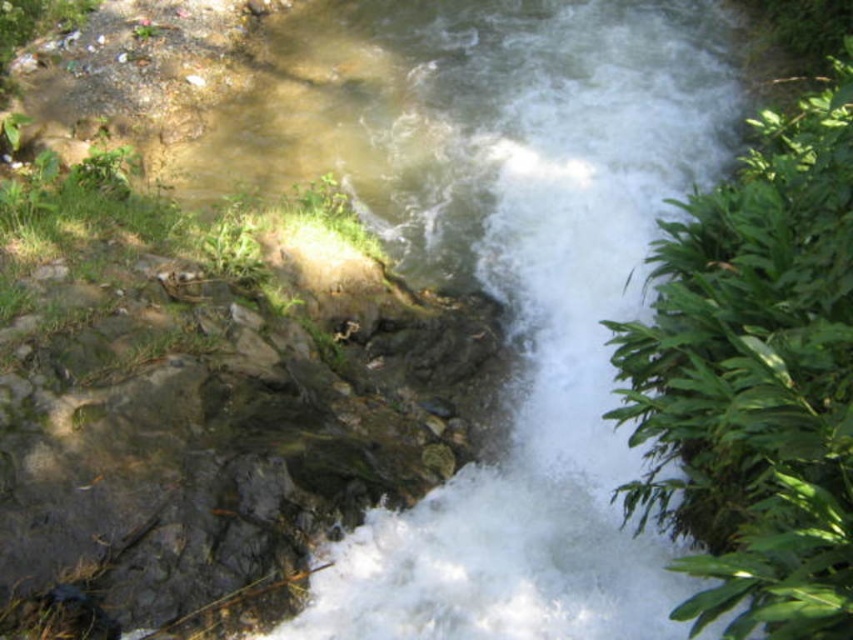
Between clear water at center and green leafy plant at right, which one has more height?

With more height is clear water at center.

Measure the distance between clear water at center and camera.

clear water at center and camera are 3.61 meters apart from each other.

Image resolution: width=853 pixels, height=640 pixels. I want to click on clear water at center, so click(502, 276).